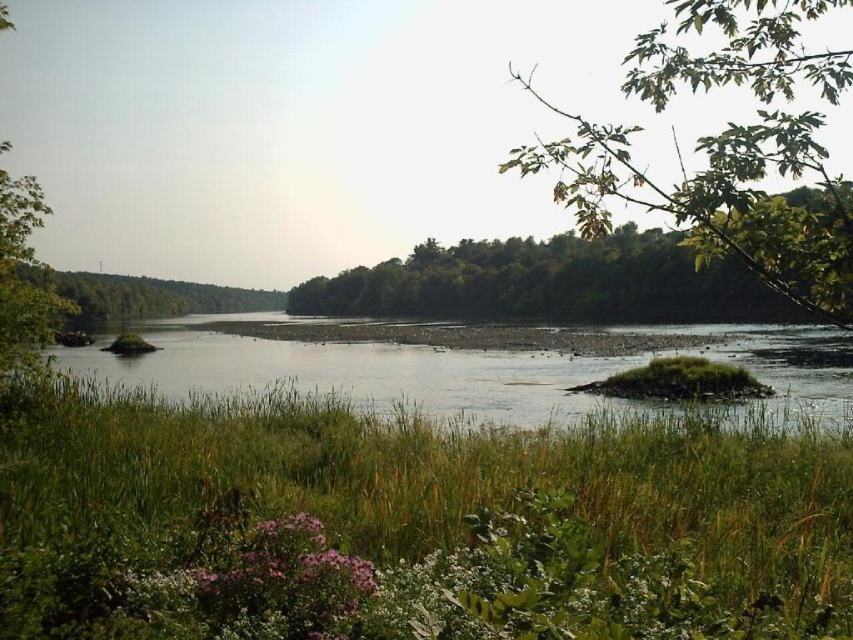
Question: Which point appears closest to the camera in this image?

Choices:
 (A) (459, 596)
 (B) (364, 269)
 (C) (843, 269)
 (D) (621, 326)

Answer: (A)

Question: Does green grassy river at center appear on the right side of green leafy branch at upper right?

Choices:
 (A) yes
 (B) no

Answer: (B)

Question: Which object is the farthest from the green leafy tree at center?

Choices:
 (A) green grassy river at center
 (B) green grassy patch at lower center

Answer: (B)

Question: Does green grassy river at center appear over green leafy branch at upper right?

Choices:
 (A) no
 (B) yes

Answer: (A)

Question: Which point appears farthest from the camera in this image?

Choices:
 (A) pos(753,221)
 (B) pos(518,252)
 (C) pos(346,621)
 (D) pos(782,365)

Answer: (B)

Question: From the image, what is the correct spatial relationship of green grassy river at center in relation to green leafy tree at center?

Choices:
 (A) below
 (B) above

Answer: (A)